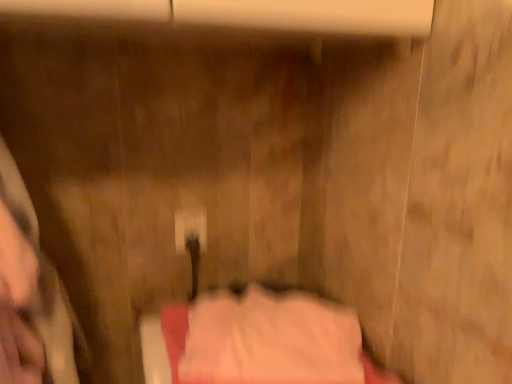
Measure the distance between fluffy beige blanket at lower left and camera.

A distance of 26.50 inches exists between fluffy beige blanket at lower left and camera.

I want to click on fluffy beige blanket at lower left, so click(42, 281).

The image size is (512, 384). Describe the element at coordinates (42, 281) in the screenshot. I see `fluffy beige blanket at lower left` at that location.

Find the location of a particular element. This screenshot has width=512, height=384. fluffy beige blanket at lower left is located at coordinates (42, 281).